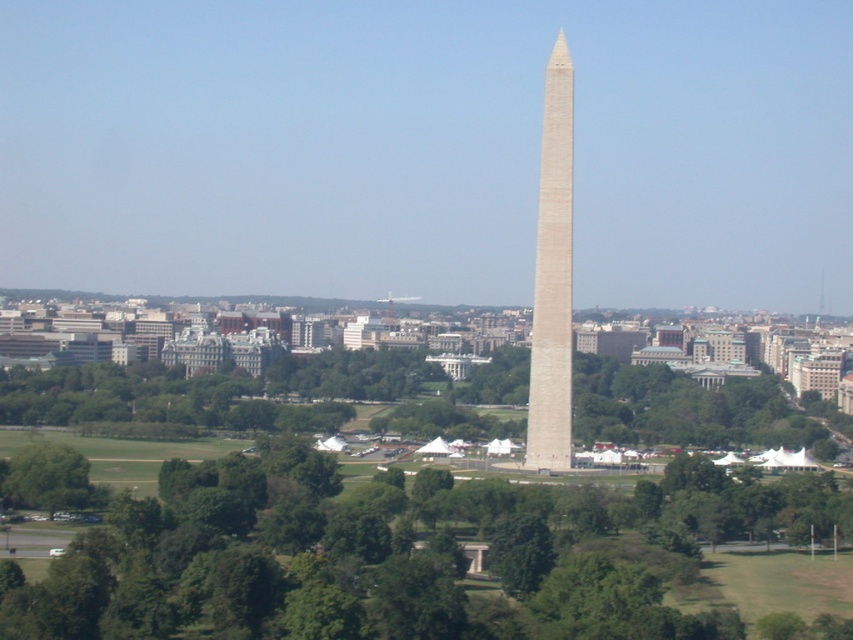
Question: Which is farther from the green leafy tree at center?

Choices:
 (A) green leafy tree at lower left
 (B) beige stone obelisk at center

Answer: (B)

Question: Observing the image, what is the correct spatial positioning of green leafy tree at center in reference to beige stone obelisk at center?

Choices:
 (A) above
 (B) below

Answer: (B)

Question: Does green leafy tree at center have a larger size compared to beige stone obelisk at center?

Choices:
 (A) yes
 (B) no

Answer: (A)

Question: Is the position of green leafy tree at center more distant than that of beige stone obelisk at center?

Choices:
 (A) yes
 (B) no

Answer: (A)

Question: Which of the following is the closest to the observer?

Choices:
 (A) green leafy tree at center
 (B) beige stone obelisk at center
 (C) green leafy tree at lower left

Answer: (B)

Question: Which point is farther to the camera?

Choices:
 (A) (177, 611)
 (B) (21, 481)
 (C) (541, 188)

Answer: (B)